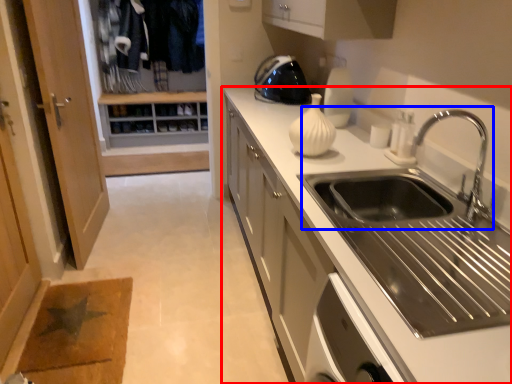
Question: Which object is further to the camera taking this photo, countertop (highlighted by a red box) or sink (highlighted by a blue box)?

Choices:
 (A) countertop
 (B) sink

Answer: (B)